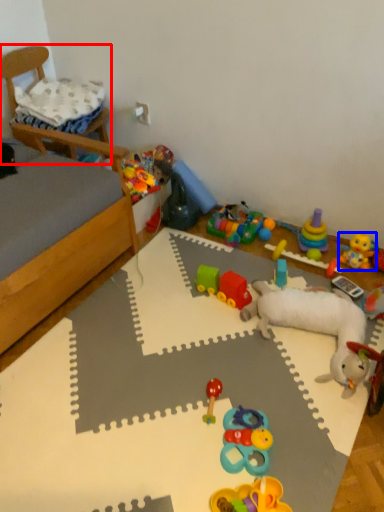
Question: Which of the following is the closest to the observer, furniture (highlighted by a red box) or toy (highlighted by a blue box)?

Choices:
 (A) furniture
 (B) toy

Answer: (B)